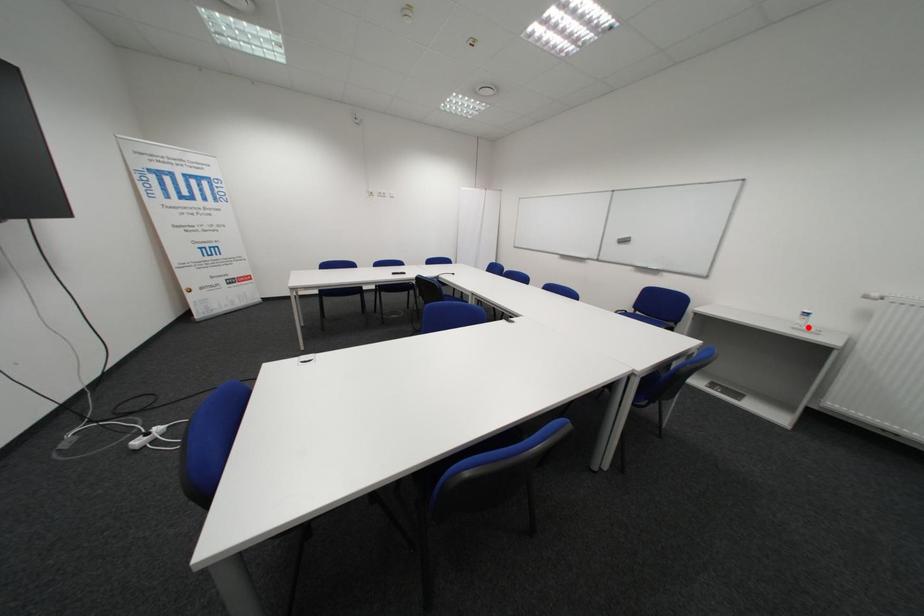
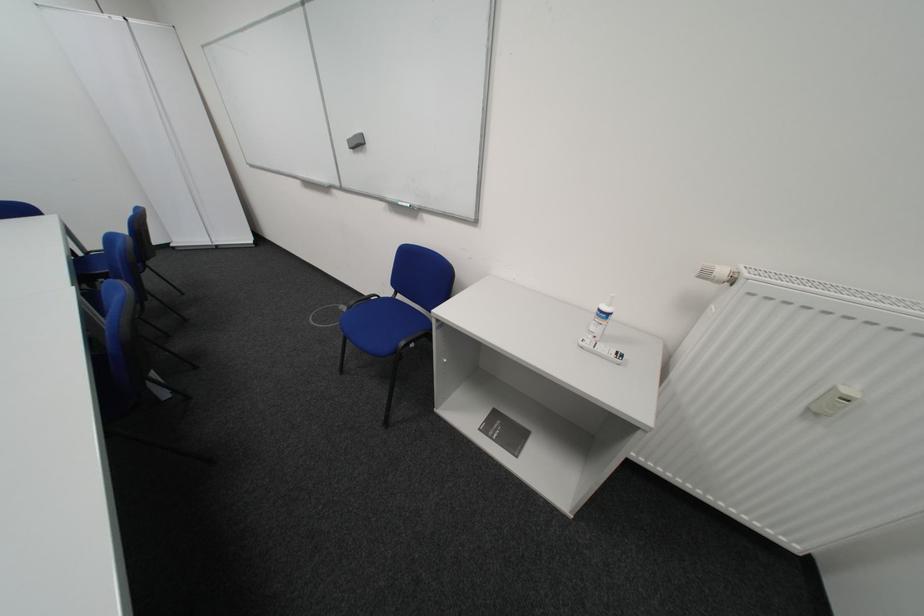
In the second image, find the point that corresponds to the highlighted location in the first image.

(599, 345)